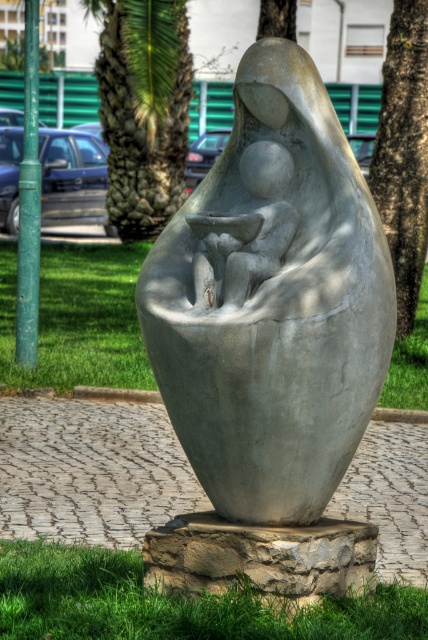
You are a gardener planning to mow the green grass at base and trim the smooth bark tree at center. Which object should you attend to first based on their proximity to you?

The green grass at base is closer to the viewer than the smooth bark tree at center, so you should mow the green grass at base first before trimming the smooth bark tree at center.

What is the location of the point with coordinates (272, 300) in the image?

The point with coordinates (272, 300) is located on the gray stone sculpture at center.